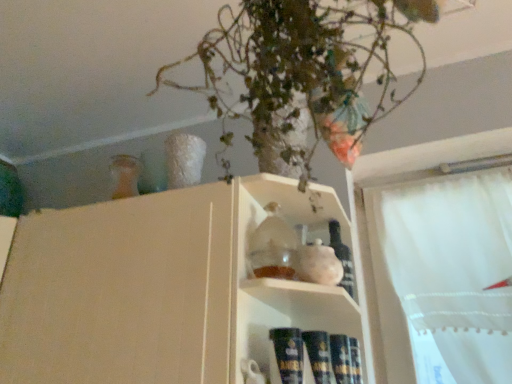
Question: Does translucent glass bottle at shelf center have a lesser height compared to matte glass jar at center?

Choices:
 (A) yes
 (B) no

Answer: (A)

Question: Can you confirm if translucent glass bottle at shelf center is taller than matte glass jar at center?

Choices:
 (A) yes
 (B) no

Answer: (B)

Question: Is translucent glass bottle at shelf center positioned before matte glass jar at center?

Choices:
 (A) yes
 (B) no

Answer: (B)

Question: From the image's perspective, is translucent glass bottle at shelf center below matte glass jar at center?

Choices:
 (A) yes
 (B) no

Answer: (B)

Question: From a real-world perspective, is translucent glass bottle at shelf center located higher than matte glass jar at center?

Choices:
 (A) no
 (B) yes

Answer: (B)

Question: Is matte glass jar at center surrounded by translucent glass bottle at shelf center?

Choices:
 (A) yes
 (B) no

Answer: (B)

Question: Considering the relative sizes of matte glass jar at center and green leafy plant at upper center in the image provided, is matte glass jar at center smaller than green leafy plant at upper center?

Choices:
 (A) no
 (B) yes

Answer: (A)

Question: Is there a large distance between matte glass jar at center and green leafy plant at upper center?

Choices:
 (A) no
 (B) yes

Answer: (A)

Question: Does matte glass jar at center have a lesser height compared to green leafy plant at upper center?

Choices:
 (A) no
 (B) yes

Answer: (A)

Question: Is matte glass jar at center thinner than green leafy plant at upper center?

Choices:
 (A) yes
 (B) no

Answer: (A)

Question: Is matte glass jar at center oriented towards green leafy plant at upper center?

Choices:
 (A) yes
 (B) no

Answer: (B)

Question: Considering the relative sizes of matte glass jar at center and green leafy plant at upper center in the image provided, is matte glass jar at center taller than green leafy plant at upper center?

Choices:
 (A) yes
 (B) no

Answer: (A)

Question: From a real-world perspective, does green leafy plant at upper center stand above translucent glass bottle at shelf center?

Choices:
 (A) yes
 (B) no

Answer: (A)